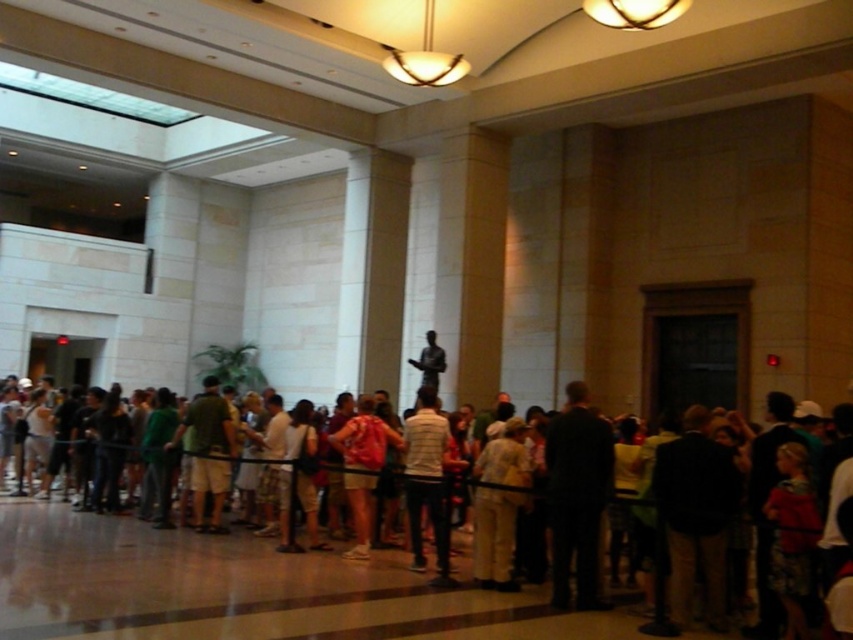
Which of these two, matte black statue at center or light beige pants at center, stands taller?

light beige pants at center is taller.

Does matte black statue at center lie behind light beige pants at center?

That is False.

Image resolution: width=853 pixels, height=640 pixels. Find the location of `matte black statue at center`. matte black statue at center is located at coordinates (250, 589).

Can you confirm if light beige pants at center is smaller than red backpack at center?

Indeed, light beige pants at center has a smaller size compared to red backpack at center.

Does light beige pants at center have a lesser width compared to red backpack at center?

Correct, light beige pants at center's width is less than red backpack at center's.

Between point (511, 547) and point (369, 538), which one is positioned in front?

Positioned in front is point (511, 547).

Locate an element on the screen. light beige pants at center is located at coordinates (494, 536).

Find the location of a particular element. light beige pants at center is located at coordinates (494, 536).

Between light beige pants at center and bronze statue at center, which one is positioned lower?

light beige pants at center

Who is more forward, (474,532) or (433,353)?

Point (474,532)

Locate an element on the screen. light beige pants at center is located at coordinates (494, 536).